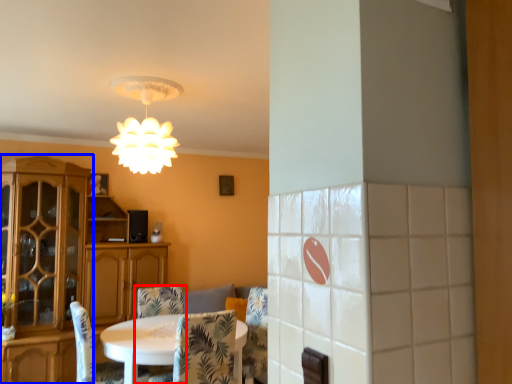
Question: Which point is further to the camera, chair (highlighted by a red box) or cabinetry (highlighted by a blue box)?

Choices:
 (A) chair
 (B) cabinetry

Answer: (B)